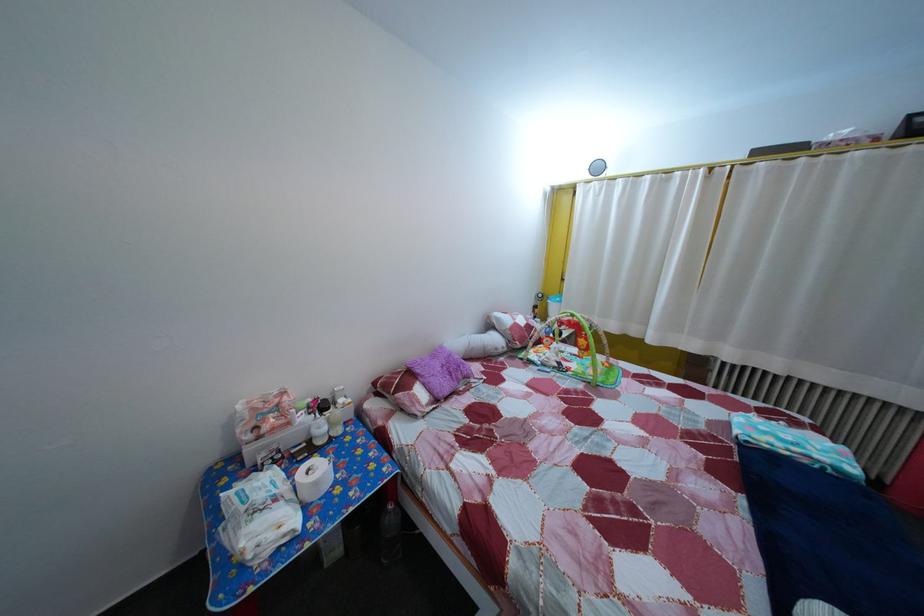
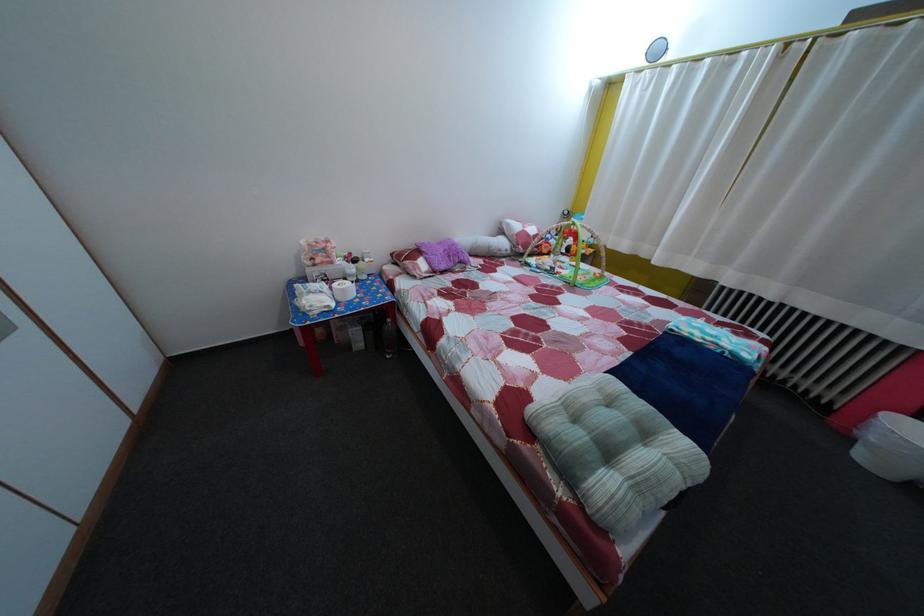
In the second image, find the point that corresponds to (x=752, y=570) in the first image.

(601, 379)